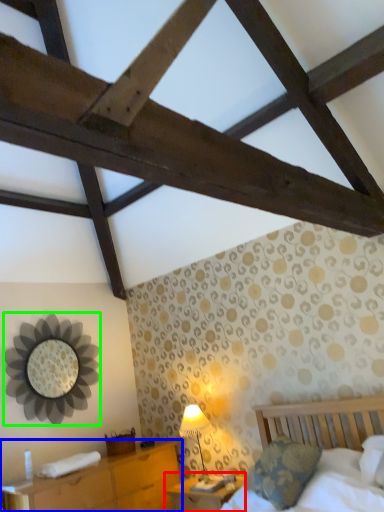
Question: Considering the real-world distances, which object is farthest from nightstand (highlighted by a red box)? nightstand (highlighted by a blue box) or mirror (highlighted by a green box)?

Choices:
 (A) nightstand
 (B) mirror

Answer: (B)